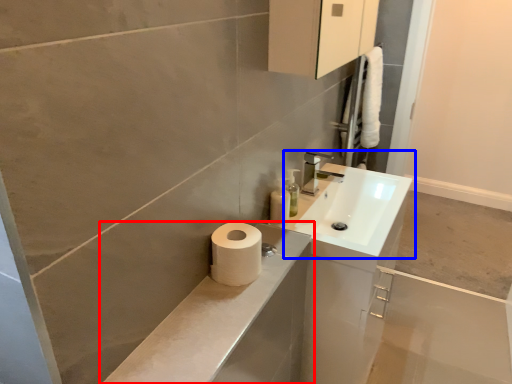
Question: Among these objects, which one is nearest to the camera, bathroom cabinet (highlighted by a red box) or sink (highlighted by a blue box)?

Choices:
 (A) bathroom cabinet
 (B) sink

Answer: (A)